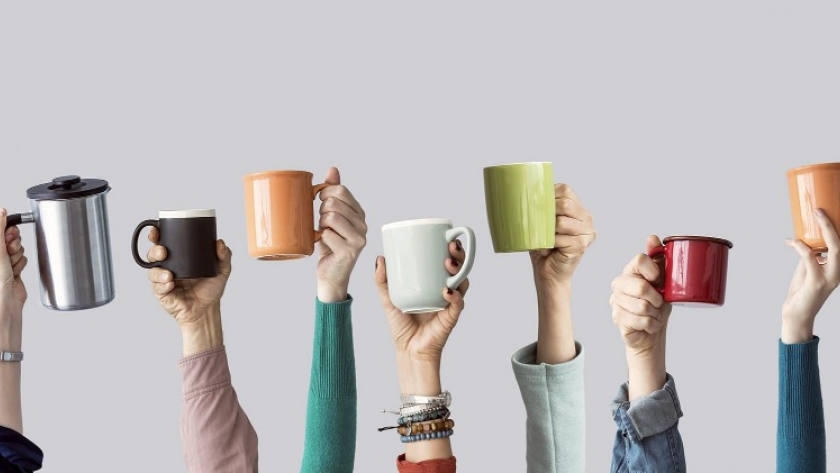
The height and width of the screenshot is (473, 840). I want to click on mugs, so click(x=74, y=247), click(x=181, y=257), click(x=286, y=230), click(x=399, y=263), click(x=520, y=211), click(x=680, y=275), click(x=815, y=197).